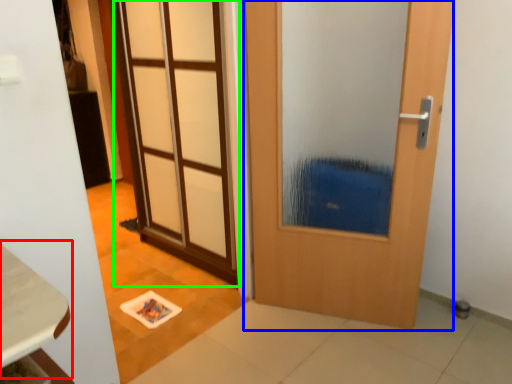
Question: Which is nearer to the table (highlighted by a red box)? door (highlighted by a blue box) or door (highlighted by a green box).

Choices:
 (A) door
 (B) door

Answer: (A)